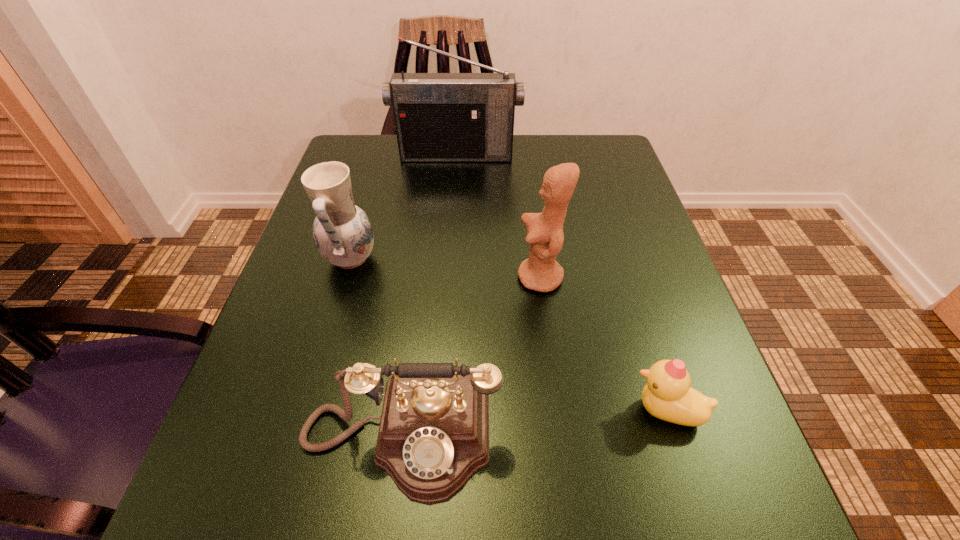
You are a GUI agent. You are given a task and a screenshot of the screen. Output one action in this format:
    pyautogui.click(x=<x>, y=<y>)
    Task: Click on the free location located on either side of the third tallest object
    This screenshot has height=540, width=960.
    Given the screenshot: What is the action you would take?
    pyautogui.click(x=424, y=260)

The width and height of the screenshot is (960, 540). In order to click on free point located 0.200m on the front-facing side of the shortest object in this screenshot , I will do `click(492, 411)`.

Locate an element on the screen. free space located 0.210m on the front-facing side of the shortest object is located at coordinates (485, 411).

You are a GUI agent. You are given a task and a screenshot of the screen. Output one action in this format:
    pyautogui.click(x=<x>, y=<y>)
    Task: Click on the vacant space located on the front-facing side of the shortest object
    This screenshot has width=960, height=540.
    Given the screenshot: What is the action you would take?
    pyautogui.click(x=595, y=411)

Identify the location of object present at the far edge. (439, 117).

Where is `object present at the near edge`? The width and height of the screenshot is (960, 540). object present at the near edge is located at coordinates click(x=433, y=436).

This screenshot has width=960, height=540. In order to click on radio receiver positioned at the left edge in this screenshot , I will do `click(439, 117)`.

At what (x,y) coordinates should I click in order to perform the action: click on pottery that is positioned at the left edge. Please return your answer as a coordinate pair (x, y). Image resolution: width=960 pixels, height=540 pixels. Looking at the image, I should click on (343, 234).

Locate an element on the screen. Image resolution: width=960 pixels, height=540 pixels. telephone that is positioned at the left edge is located at coordinates (433, 436).

Identify the location of object that is at the right edge. (668, 395).